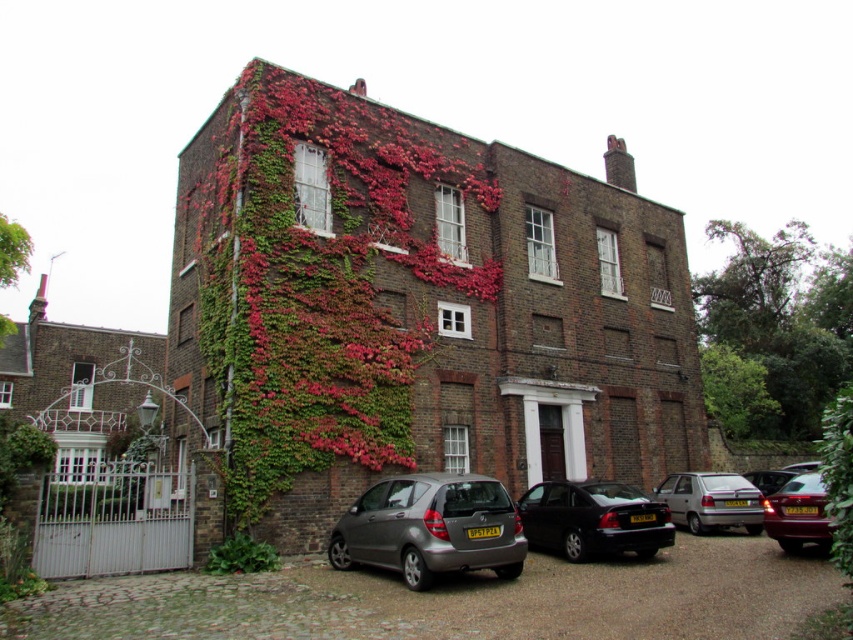
Question: Which of the following is the farthest from the observer?

Choices:
 (A) (578, 486)
 (B) (776, 490)
 (C) (383, 540)
 (D) (764, 522)

Answer: (B)

Question: Can you confirm if satin grey car at lower center is positioned below silver metallic car at lower right?

Choices:
 (A) yes
 (B) no

Answer: (B)

Question: Among these objects, which one is farthest from the camera?

Choices:
 (A) shiny maroon sedan at right
 (B) shiny black sedan at center
 (C) satin grey car at lower center
 (D) silver metallic car at lower right

Answer: (D)

Question: Does silver metallic car at lower right appear under shiny maroon sedan at right?

Choices:
 (A) no
 (B) yes

Answer: (B)

Question: Which object is positioned closest to the shiny black sedan at center?

Choices:
 (A) satin grey car at lower center
 (B) shiny maroon sedan at right

Answer: (A)

Question: Does shiny black sedan at center appear over silver metallic car at lower right?

Choices:
 (A) yes
 (B) no

Answer: (A)